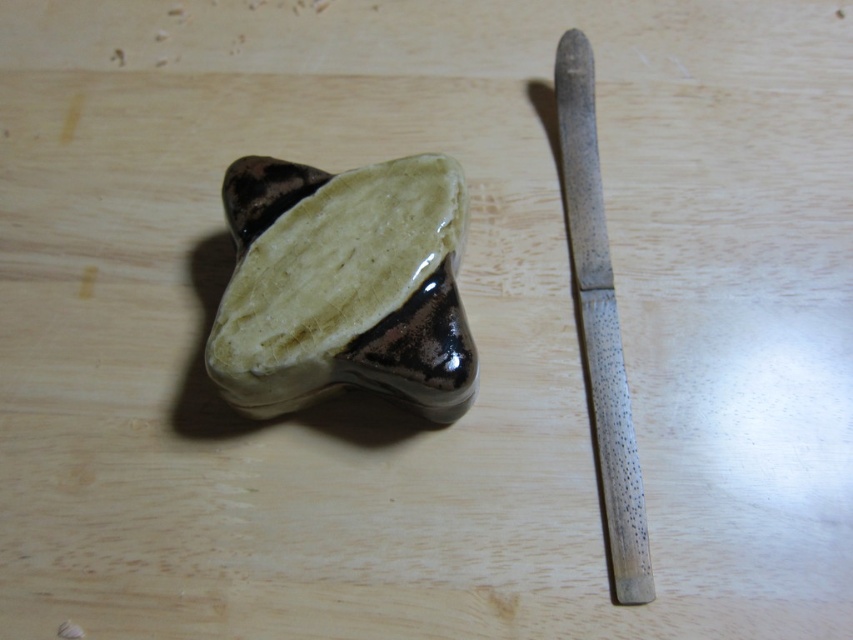
Does glossy ceramic stone at center have a greater width compared to speckled wood knife at right?

Indeed, glossy ceramic stone at center has a greater width compared to speckled wood knife at right.

Is point (370, 323) more distant than point (583, 332)?

No, it is in front of (583, 332).

Locate an element on the screen. glossy ceramic stone at center is located at coordinates (344, 285).